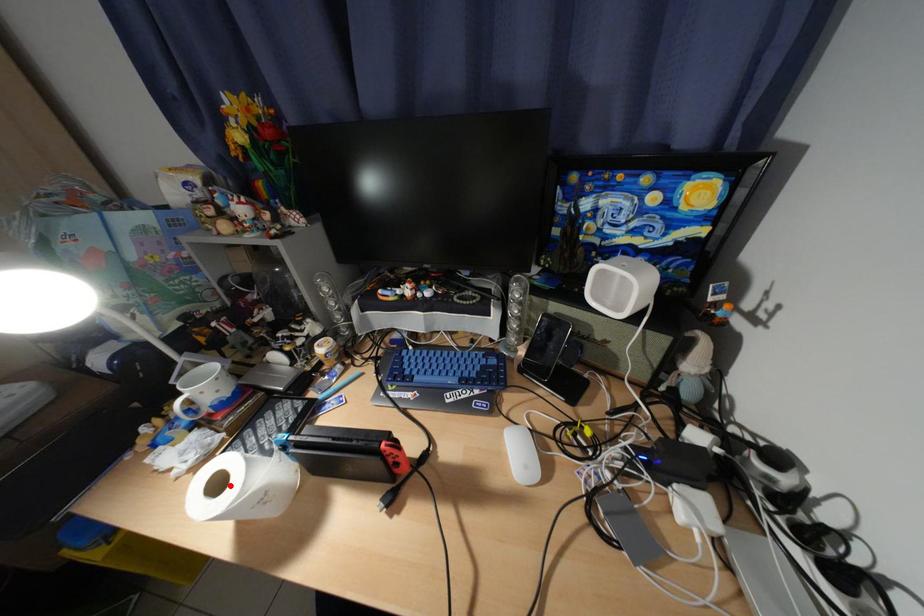
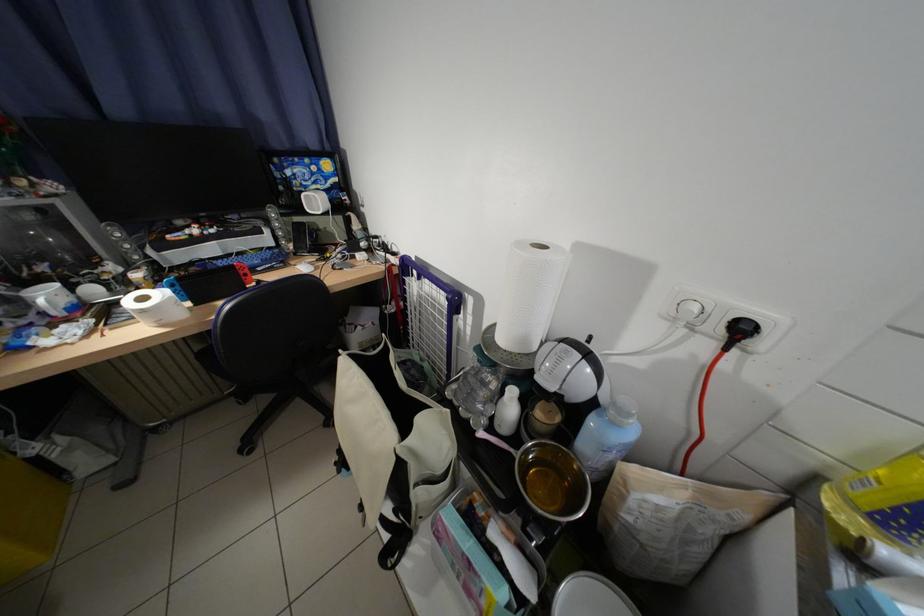
Locate, in the second image, the point that corresponds to the highlighted location in the first image.

(155, 301)